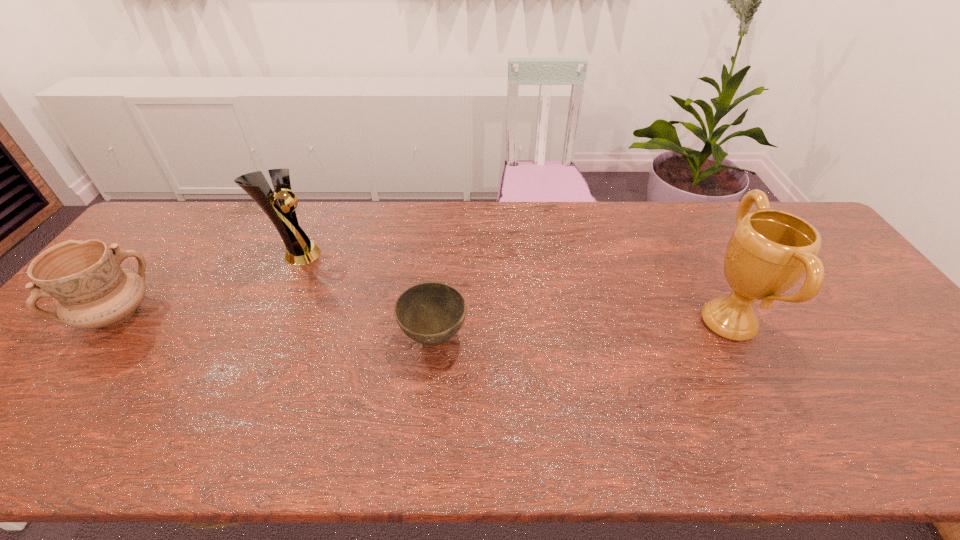
I want to click on free spot between the right award and the farthest object, so click(x=512, y=288).

Locate an element on the screen. free space that is in between the second object from left to right and the nearer award is located at coordinates (512, 288).

Find the location of a particular element. This screenshot has width=960, height=540. unoccupied position between the farther award and the shortest object is located at coordinates (365, 296).

Locate an element on the screen. This screenshot has width=960, height=540. free space between the shortest object and the farthest object is located at coordinates (365, 296).

Identify the location of free space between the third tallest object and the third object from left to right. Image resolution: width=960 pixels, height=540 pixels. (276, 326).

Locate an element on the screen. This screenshot has width=960, height=540. vacant space that's between the farther award and the nearer award is located at coordinates (512, 288).

This screenshot has height=540, width=960. What are the coordinates of `vacant area between the pottery and the shortest object` in the screenshot? It's located at [x=276, y=326].

Locate an element on the screen. free spot between the farther award and the pottery is located at coordinates (206, 284).

At what (x,y) coordinates should I click in order to perform the action: click on object that is the nearest to the third object from right to left. Please return your answer as a coordinate pair (x, y). Looking at the image, I should click on [x=92, y=290].

The image size is (960, 540). In order to click on object that is the closest to the rightmost object in this screenshot , I will do `click(431, 313)`.